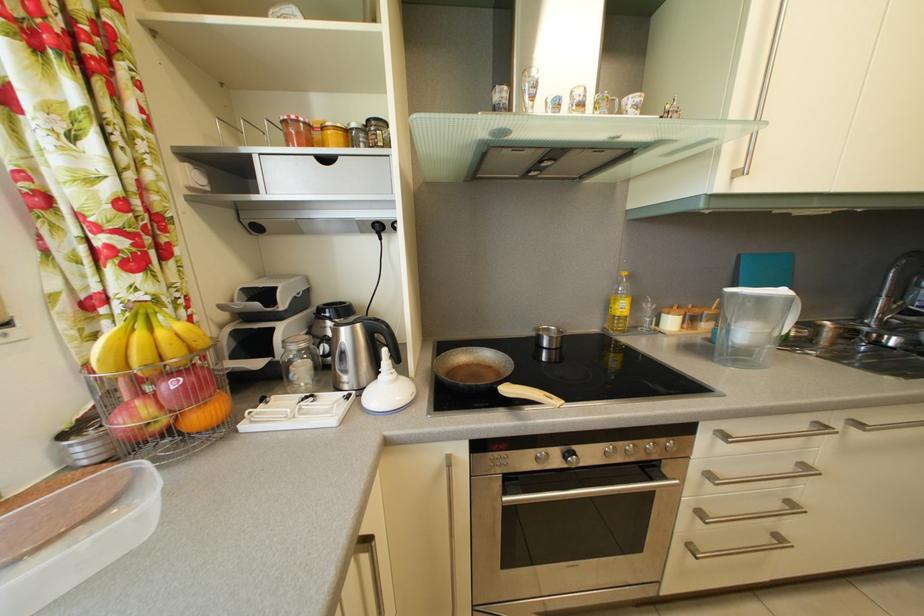
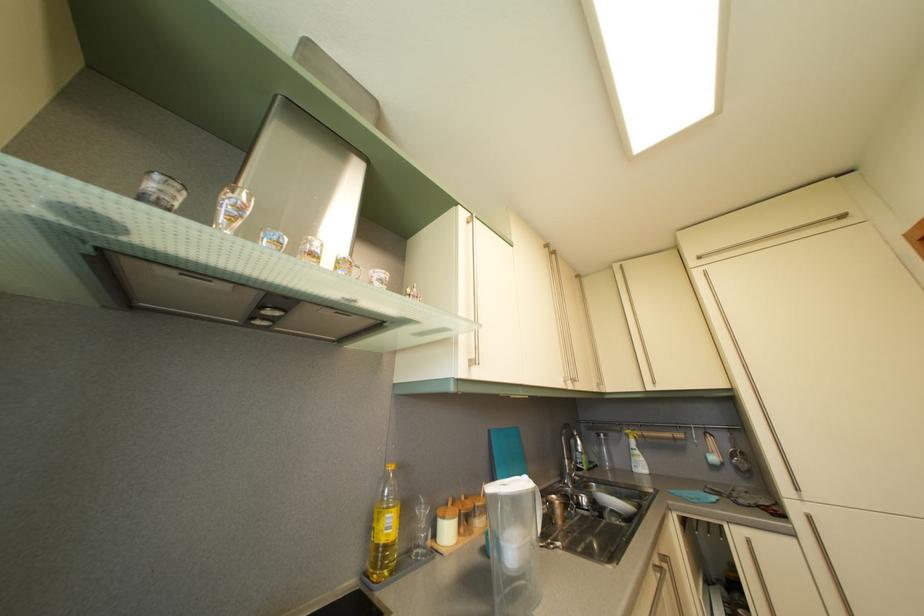
Find the pixel in the second image that matches the point at 674,317 in the first image.

(448, 519)